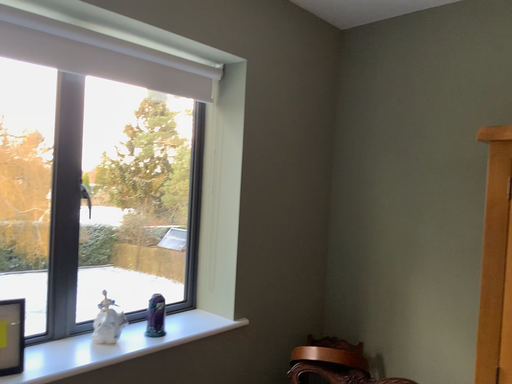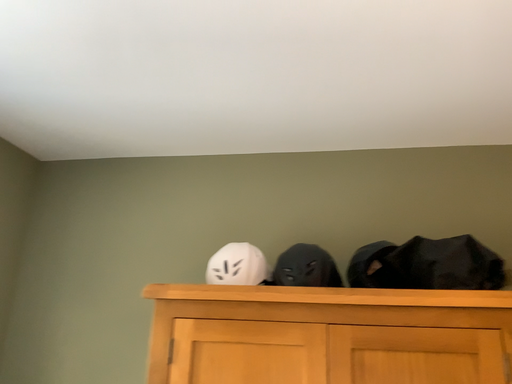
Question: How did the camera likely rotate when shooting the video?

Choices:
 (A) rotated upward
 (B) rotated downward

Answer: (A)